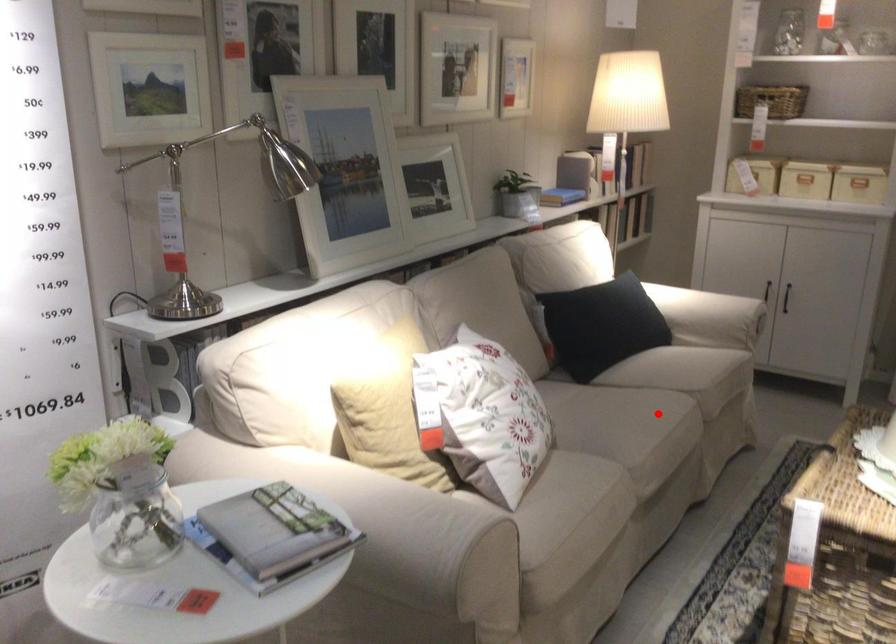
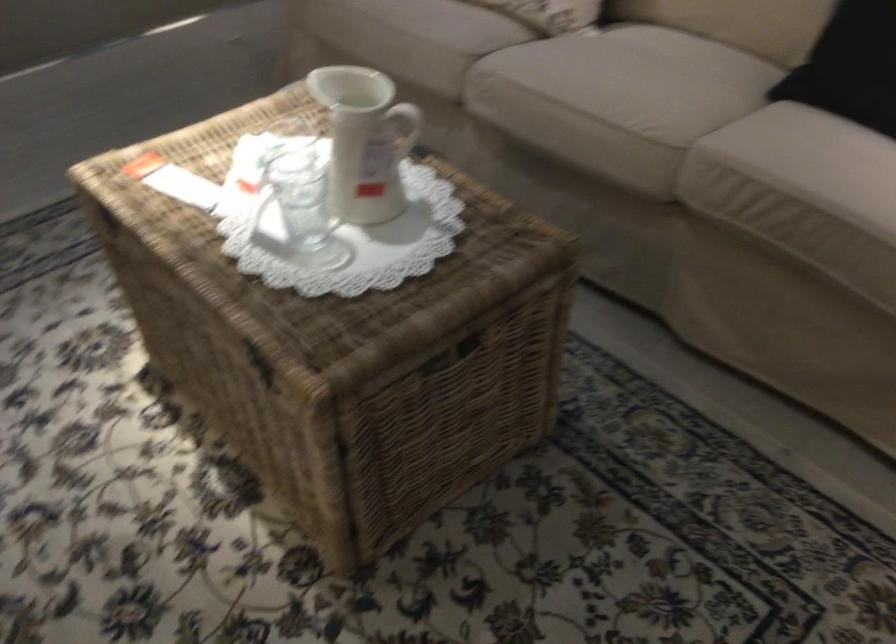
Where in the second image is the point corresponding to the highlighted location from the first image?

(617, 93)